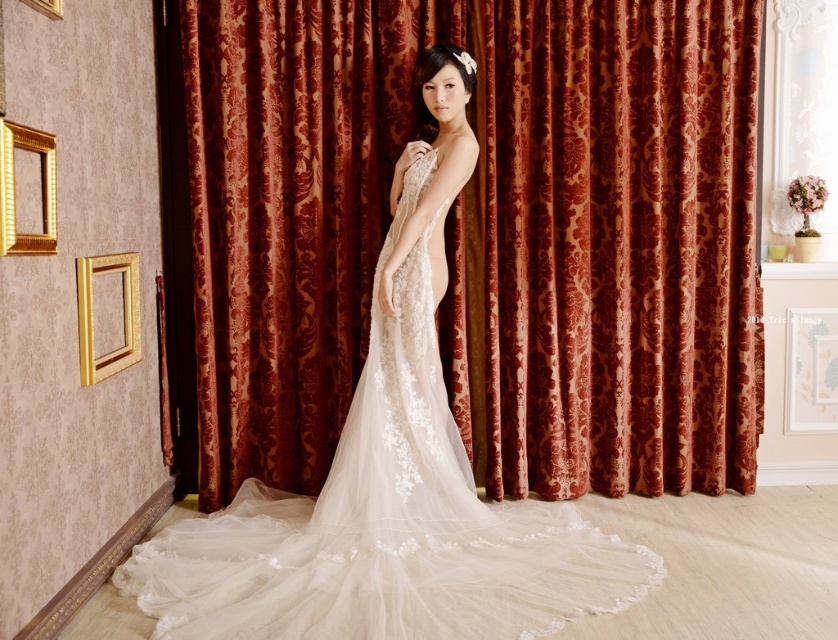
Question: Among these points, which one is nearest to the camera?

Choices:
 (A) (149, 554)
 (B) (556, 170)

Answer: (A)

Question: Which point is closer to the camera?

Choices:
 (A) white lace dress at center
 (B) velvet-like burgundy curtain at center

Answer: (A)

Question: Is velvet-like burgundy curtain at center smaller than white lace dress at center?

Choices:
 (A) yes
 (B) no

Answer: (A)

Question: Can you confirm if velvet-like burgundy curtain at center is positioned to the right of white lace dress at center?

Choices:
 (A) no
 (B) yes

Answer: (B)

Question: Which point is farther from the camera taking this photo?

Choices:
 (A) (278, 497)
 (B) (648, 349)

Answer: (B)

Question: Is velvet-like burgundy curtain at center above white lace dress at center?

Choices:
 (A) no
 (B) yes

Answer: (B)